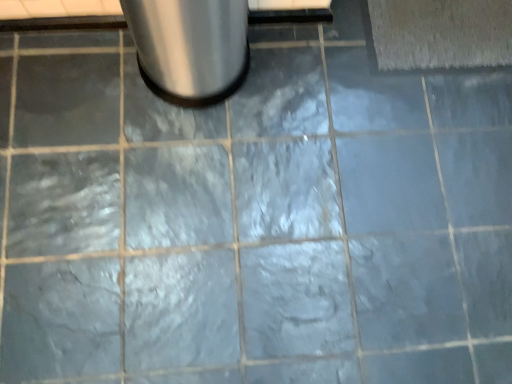
Locate an element on the screen. The image size is (512, 384). beige textured bath mat at upper right is located at coordinates (441, 33).

Image resolution: width=512 pixels, height=384 pixels. What do you see at coordinates (441, 33) in the screenshot? I see `beige textured bath mat at upper right` at bounding box center [441, 33].

Consider the image. Measure the distance between satin silver trash can at upper left and camera.

satin silver trash can at upper left is 33.54 inches from camera.

In order to click on satin silver trash can at upper left in this screenshot , I will do `click(190, 47)`.

This screenshot has width=512, height=384. What do you see at coordinates (190, 47) in the screenshot? I see `satin silver trash can at upper left` at bounding box center [190, 47].

What is the approximate width of satin silver trash can at upper left?

satin silver trash can at upper left is 11.76 inches wide.

In order to click on beige textured bath mat at upper right in this screenshot , I will do `click(441, 33)`.

Between beige textured bath mat at upper right and satin silver trash can at upper left, which one appears on the left side from the viewer's perspective?

satin silver trash can at upper left.

In the image, is beige textured bath mat at upper right positioned in front of or behind satin silver trash can at upper left?

Clearly, beige textured bath mat at upper right is behind satin silver trash can at upper left.

Between point (489, 33) and point (203, 101), which one is positioned behind?

The point (489, 33) is farther.

From the image's perspective, between beige textured bath mat at upper right and satin silver trash can at upper left, who is located below?

From the image's view, satin silver trash can at upper left is below.

From a real-world perspective, is beige textured bath mat at upper right beneath satin silver trash can at upper left?

Indeed, from a real-world perspective, beige textured bath mat at upper right is positioned beneath satin silver trash can at upper left.

Considering the relative sizes of beige textured bath mat at upper right and satin silver trash can at upper left in the image provided, is beige textured bath mat at upper right wider than satin silver trash can at upper left?

Incorrect, the width of beige textured bath mat at upper right does not surpass that of satin silver trash can at upper left.

Is beige textured bath mat at upper right shorter than satin silver trash can at upper left?

Correct, beige textured bath mat at upper right is not as tall as satin silver trash can at upper left.

Who is bigger, beige textured bath mat at upper right or satin silver trash can at upper left?

satin silver trash can at upper left.

Would you say beige textured bath mat at upper right is inside or outside satin silver trash can at upper left?

The correct answer is: outside.

Is beige textured bath mat at upper right directly adjacent to satin silver trash can at upper left?

No, beige textured bath mat at upper right is not beside satin silver trash can at upper left.

Is beige textured bath mat at upper right facing towards satin silver trash can at upper left?

No, beige textured bath mat at upper right is not oriented towards satin silver trash can at upper left.

In the image, there is a beige textured bath mat at upper right. Identify the location of waste container below it (from the image's perspective). (190, 47).

Considering the relative positions of satin silver trash can at upper left and beige textured bath mat at upper right in the image provided, is satin silver trash can at upper left to the left of beige textured bath mat at upper right from the viewer's perspective?

Yes, satin silver trash can at upper left is to the left of beige textured bath mat at upper right.

Considering their positions, is satin silver trash can at upper left located in front of or behind beige textured bath mat at upper right?

In the image, satin silver trash can at upper left appears in front of beige textured bath mat at upper right.

Considering the points (168, 62) and (497, 3), which point is behind, point (168, 62) or point (497, 3)?

The point (497, 3) is farther from the camera.

From the image's perspective, is satin silver trash can at upper left above beige textured bath mat at upper right?

Incorrect, from the image's perspective, satin silver trash can at upper left is lower than beige textured bath mat at upper right.

Looking at this image, from a real-world perspective, which object stands above the other?

satin silver trash can at upper left.

Is satin silver trash can at upper left wider than beige textured bath mat at upper right?

Correct, the width of satin silver trash can at upper left exceeds that of beige textured bath mat at upper right.

Which of these two, satin silver trash can at upper left or beige textured bath mat at upper right, stands shorter?

Standing shorter between the two is beige textured bath mat at upper right.

Considering the sizes of objects satin silver trash can at upper left and beige textured bath mat at upper right in the image provided, who is bigger, satin silver trash can at upper left or beige textured bath mat at upper right?

satin silver trash can at upper left.

Is satin silver trash can at upper left positioned beyond the bounds of beige textured bath mat at upper right?

Yes, satin silver trash can at upper left is not within beige textured bath mat at upper right.

Is satin silver trash can at upper left positioned far away from beige textured bath mat at upper right?

That's not correct — satin silver trash can at upper left is a little close to beige textured bath mat at upper right.

Does satin silver trash can at upper left turn towards beige textured bath mat at upper right?

No.

In the scene shown: What's the angular difference between satin silver trash can at upper left and beige textured bath mat at upper right's facing directions?

0.176 degrees separate the facing orientations of satin silver trash can at upper left and beige textured bath mat at upper right.

At what (x,y) coordinates should I click in order to perform the action: click on waste container above the beige textured bath mat at upper right (from a real-world perspective). Please return your answer as a coordinate pair (x, y). Looking at the image, I should click on pos(190,47).

Locate an element on the screen. This screenshot has height=384, width=512. waste container below the beige textured bath mat at upper right (from the image's perspective) is located at coordinates (190, 47).

Where is `bath mat behind the satin silver trash can at upper left`? bath mat behind the satin silver trash can at upper left is located at coordinates (441, 33).